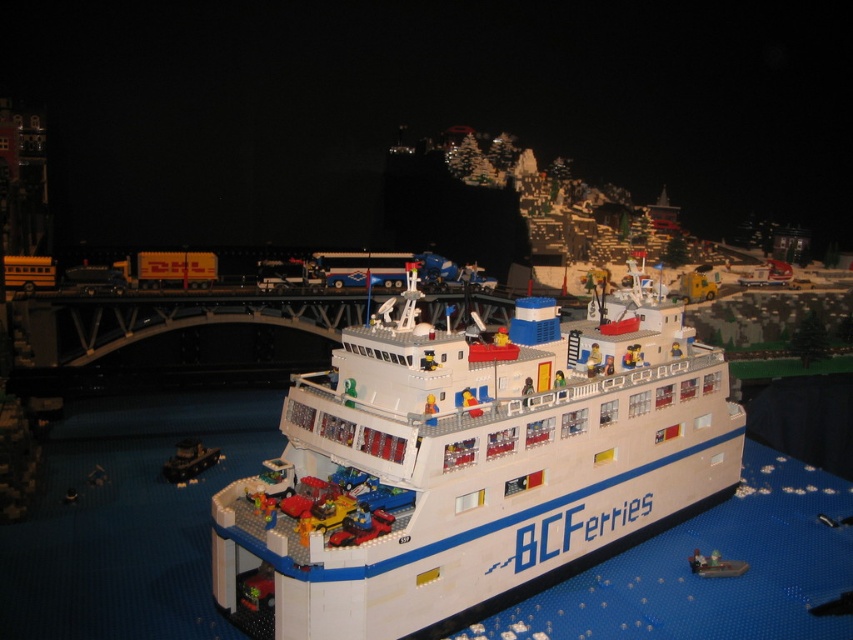
Between smooth black boat at lower left and white plastic boat at center, which one has less height?

white plastic boat at center is shorter.

What do you see at coordinates (189, 460) in the screenshot? I see `smooth black boat at lower left` at bounding box center [189, 460].

Where is `smooth black boat at lower left`? This screenshot has width=853, height=640. smooth black boat at lower left is located at coordinates (189, 460).

Who is higher up, white plastic cruise ship at center or smooth black boat at lower left?

white plastic cruise ship at center is above.

Is white plastic cruise ship at center taller than smooth black boat at lower left?

Yes.

Who is more forward, (670,371) or (175,452)?

Point (670,371)

Identify the location of white plastic cruise ship at center. The height and width of the screenshot is (640, 853). (469, 465).

Does point (469, 355) come closer to viewer compared to point (704, 576)?

That is False.

Looking at this image, who is lower down, white plastic cruise ship at center or white plastic boat at center?

white plastic boat at center

Is point (234, 605) positioned before point (726, 564)?

Yes, point (234, 605) is closer to viewer.

I want to click on white plastic cruise ship at center, so click(469, 465).